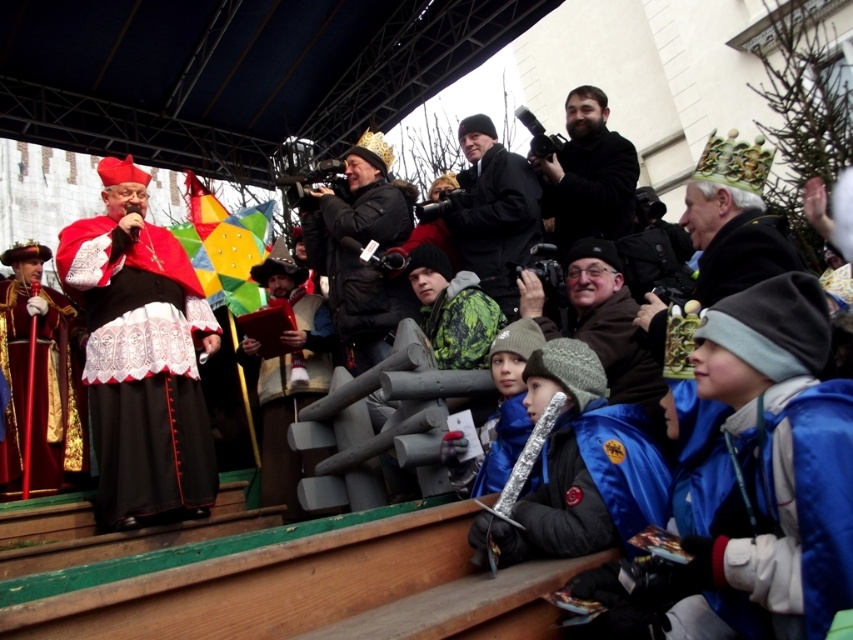
Based on the photo, you are a photographer attending the event and want to capture both the black matte crown at center and the bearded man with camera at upper center in the same frame. Considering their sizes, which object should you focus on to ensure both are visible?

The black matte crown at center is larger than the bearded man with camera at upper center, so focusing on the crown will allow both to be visible in the frame as it occupies more space.

In the scene shown: You are a photographer at the event and need to position yourself to capture the black matte crown at center in your shot. Based on the scene description, where should you aim your camera to ensure the crown is centered in your frame?

You should aim your camera at the coordinates point (357, 250) to center the black matte crown at center in your frame.

You are standing at the center of the stage. There is a silver metallic sword at lower center. Where is the point located at coordinates (590,484)?

The point at coordinates (590,484) is on the silver metallic sword at lower center.